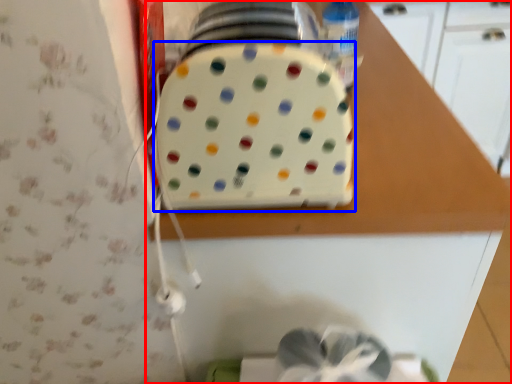
Question: Which object appears closest to the camera in this image, countertop (highlighted by a red box) or toaster (highlighted by a blue box)?

Choices:
 (A) countertop
 (B) toaster

Answer: (B)